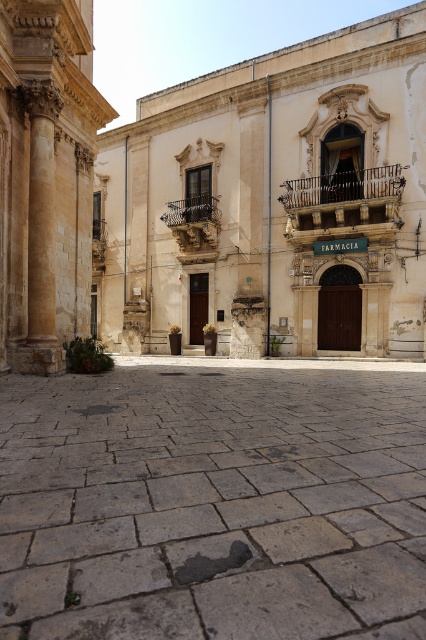
Does gray stone plaza at center appear on the left side of golden stone column at left?

Incorrect, gray stone plaza at center is not on the left side of golden stone column at left.

Where is `gray stone plaza at center`? gray stone plaza at center is located at coordinates point(213,500).